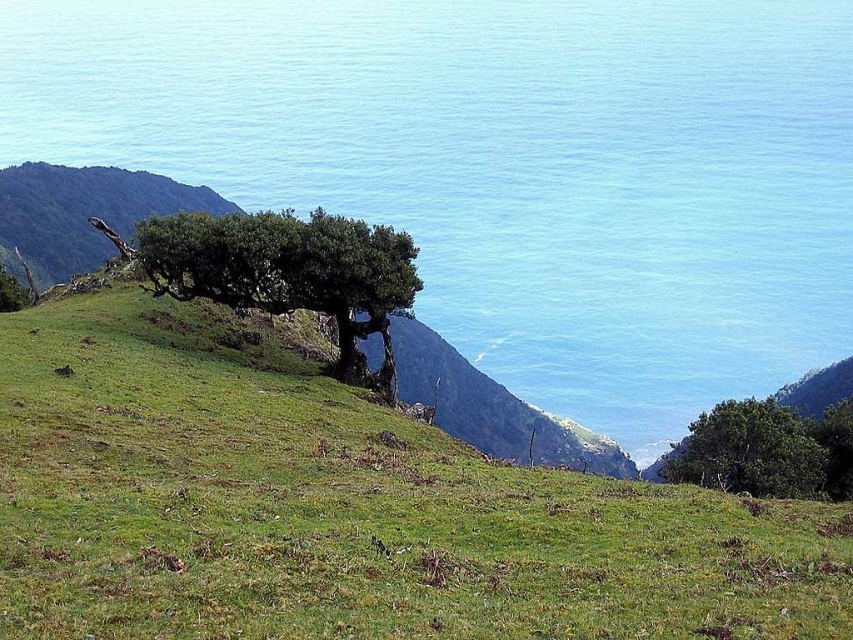
Question: Does blue water at upper center appear under green leafy tree at lower right?

Choices:
 (A) yes
 (B) no

Answer: (B)

Question: Which point appears farthest from the camera in this image?

Choices:
 (A) (299, 124)
 (B) (62, 182)
 (C) (80, 317)

Answer: (A)

Question: Among these points, which one is farthest from the camera?

Choices:
 (A) (790, 442)
 (B) (165, 180)

Answer: (B)

Question: Observing the image, what is the correct spatial positioning of green leafy tree at center in reference to green grassy hill at upper left?

Choices:
 (A) left
 (B) right

Answer: (B)

Question: Is green grassy hill at upper left bigger than green leafy tree at lower right?

Choices:
 (A) yes
 (B) no

Answer: (A)

Question: Which object is the farthest from the green leafy tree at lower right?

Choices:
 (A) green grassy hillside at center
 (B) blue water at upper center
 (C) green grassy hill at upper left
 (D) green leafy tree at center

Answer: (B)